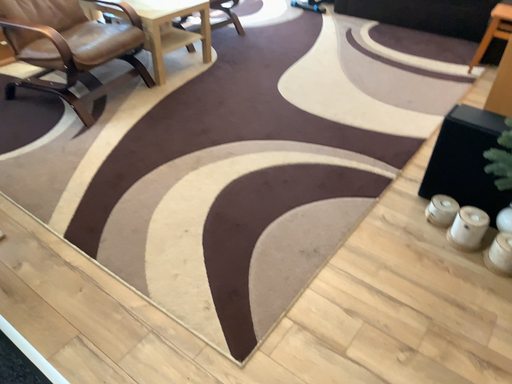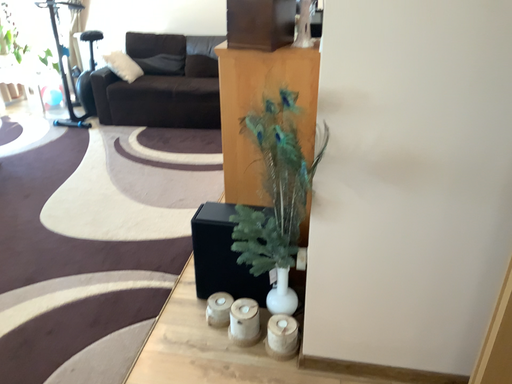
Question: Which way did the camera rotate in the video?

Choices:
 (A) rotated left
 (B) rotated right

Answer: (B)